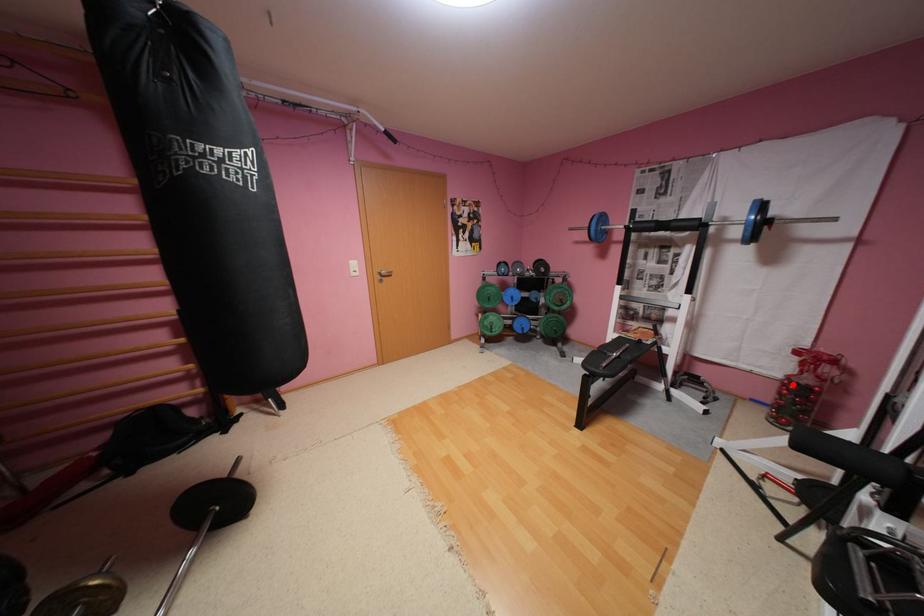
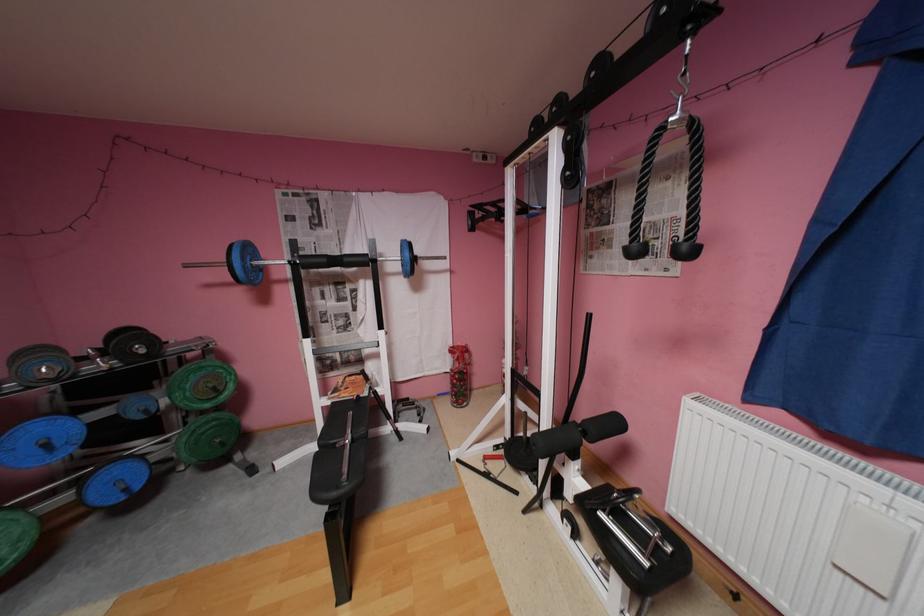
Question: I am providing you with two images of the same scene from different viewpoints. A red point is shown in image1. For the corresponding object point in image2, is it positioned nearer or farther from the camera?

Choices:
 (A) Nearer
 (B) Farther

Answer: (B)